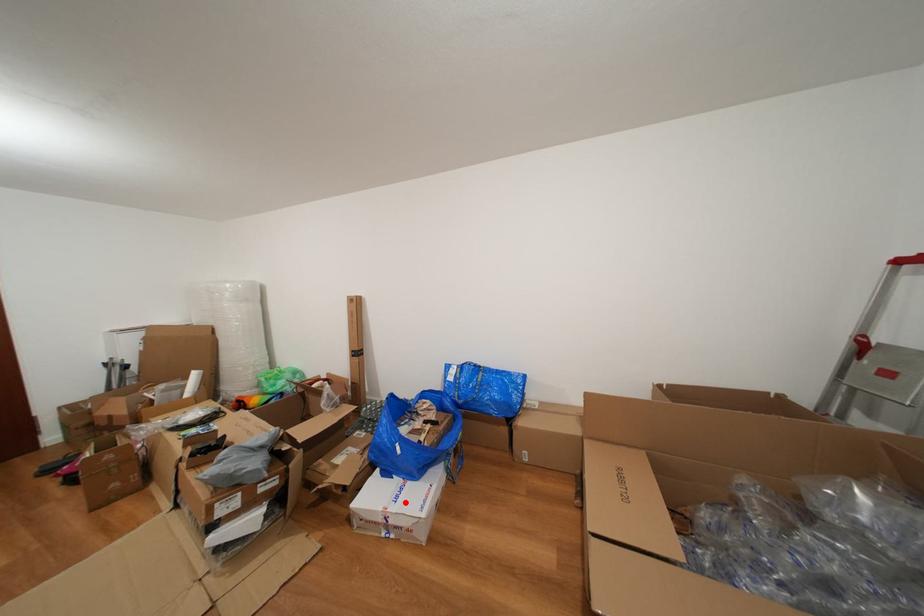
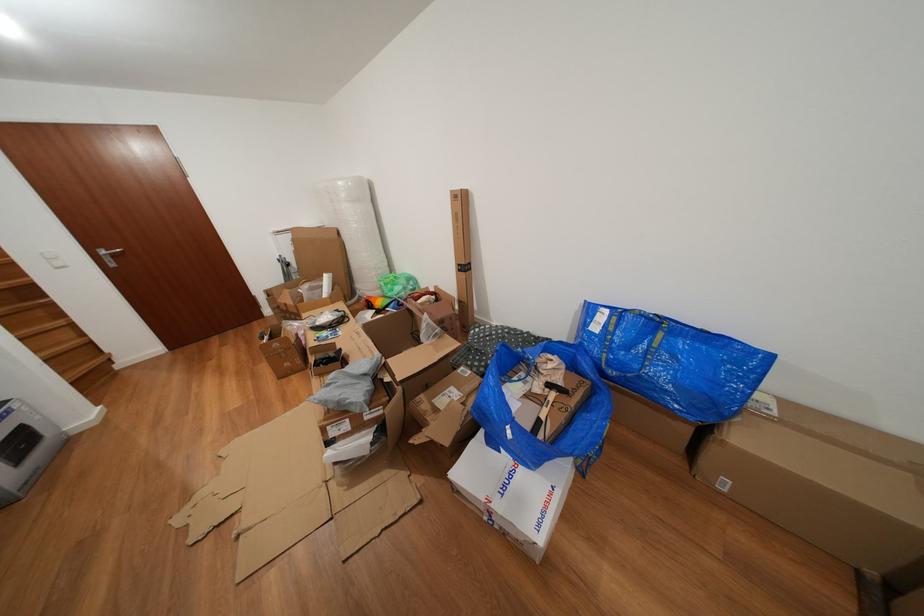
Question: A red point is marked in image1. In image2, is the corresponding 3D point closer to the camera or farther? Reply with the corresponding letter.

Choices:
 (A) The corresponding 3D point is closer.
 (B) The corresponding 3D point is farther.

Answer: (A)